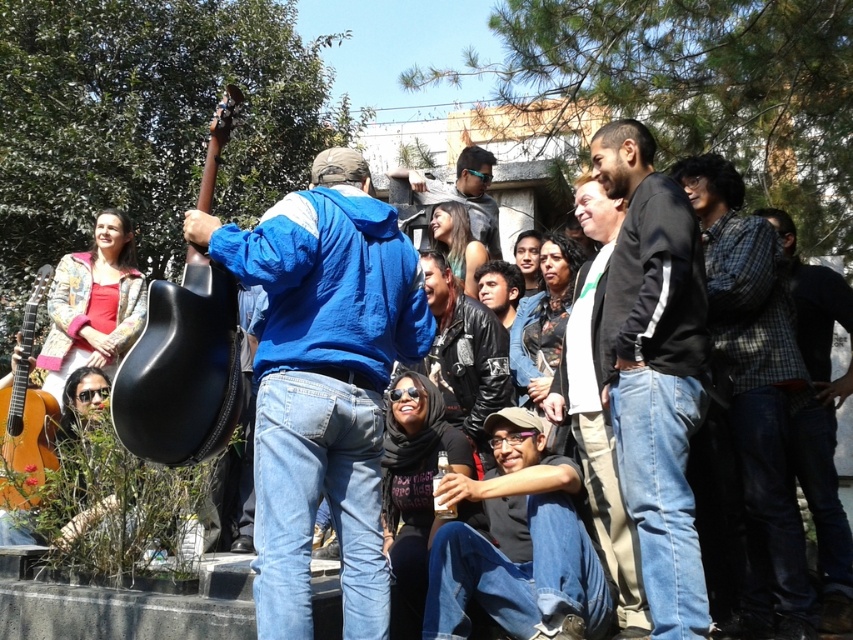
Describe the element at coordinates (654, 371) in the screenshot. This screenshot has width=853, height=640. I see `black fleece jacket at center` at that location.

Who is shorter, black fleece jacket at center or checkered fabric shirt at center?

black fleece jacket at center

Locate an element on the screen. black fleece jacket at center is located at coordinates (654, 371).

Where is `black fleece jacket at center`? This screenshot has height=640, width=853. black fleece jacket at center is located at coordinates (654, 371).

Is point (438, 596) less distant than point (421, 216)?

Yes, point (438, 596) is closer to viewer.

In order to click on black matte shirt at center in this screenshot , I will do `click(517, 544)`.

Identify the location of black matte shirt at center. The width and height of the screenshot is (853, 640). (517, 544).

Image resolution: width=853 pixels, height=640 pixels. What do you see at coordinates (755, 396) in the screenshot? I see `checkered fabric shirt at center` at bounding box center [755, 396].

Between checkered fabric shirt at center and black matte guitar at left, which one appears on the right side from the viewer's perspective?

checkered fabric shirt at center is more to the right.

Locate an element on the screen. The width and height of the screenshot is (853, 640). checkered fabric shirt at center is located at coordinates (755, 396).

Where is `checkered fabric shirt at center`? This screenshot has height=640, width=853. checkered fabric shirt at center is located at coordinates (755, 396).